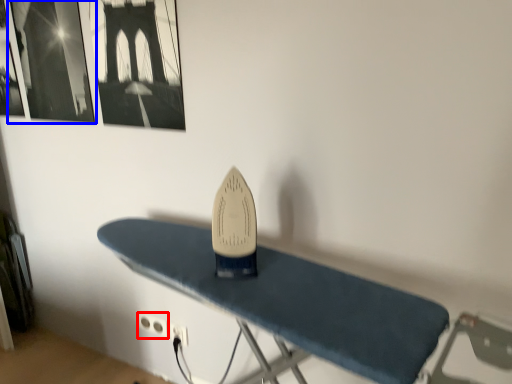
Question: Which object appears farthest to the camera in this image, plug (highlighted by a red box) or picture frame (highlighted by a blue box)?

Choices:
 (A) plug
 (B) picture frame

Answer: (A)